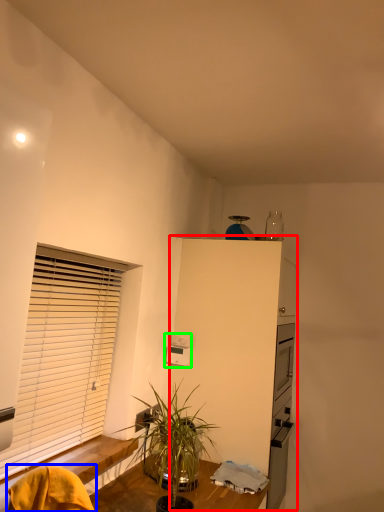
Question: Which object is positioned closest to dresser (highlighted by a red box)? Select from swivel chair (highlighted by a blue box) and appliance (highlighted by a green box).

Choices:
 (A) swivel chair
 (B) appliance

Answer: (B)